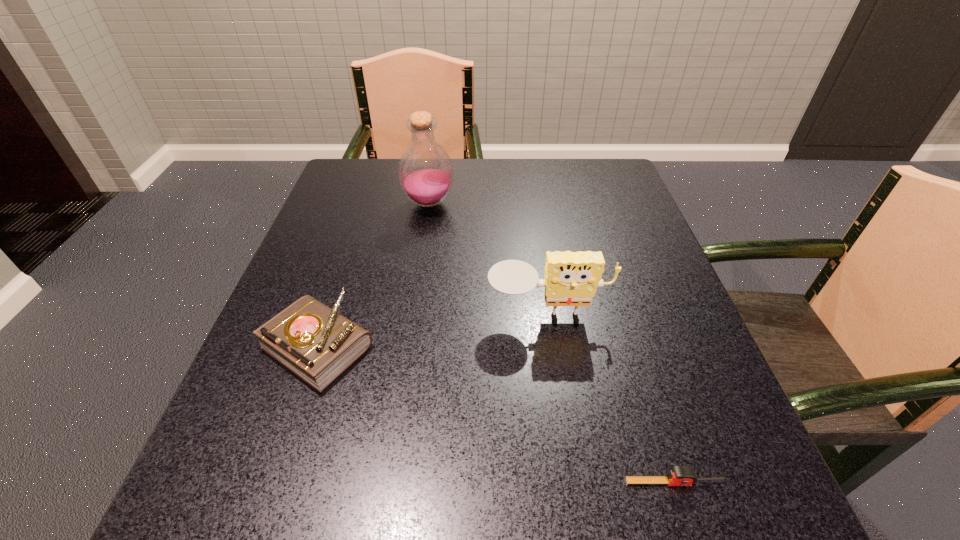
Locate an element on the screen. The width and height of the screenshot is (960, 540). object situated at the far edge is located at coordinates (425, 171).

Find the location of a particular element. object at the near edge is located at coordinates (678, 475).

Identify the location of object located at the left edge. The image size is (960, 540). (315, 342).

This screenshot has height=540, width=960. Find the location of `sponge situated at the right edge`. sponge situated at the right edge is located at coordinates (571, 278).

Locate an element on the screen. This screenshot has height=540, width=960. tape measure that is at the right edge is located at coordinates (678, 475).

This screenshot has height=540, width=960. Identify the location of object that is positioned at the near right corner. (678, 475).

Identify the location of free space at the far edge of the desktop. This screenshot has width=960, height=540. (468, 181).

What are the coordinates of `free space at the near edge of the desktop` in the screenshot? It's located at (442, 534).

In the image, there is a desktop. Where is `free space at the left edge`? This screenshot has height=540, width=960. free space at the left edge is located at coordinates (238, 438).

The width and height of the screenshot is (960, 540). In order to click on vacant position at the right edge of the desktop in this screenshot , I will do `click(630, 307)`.